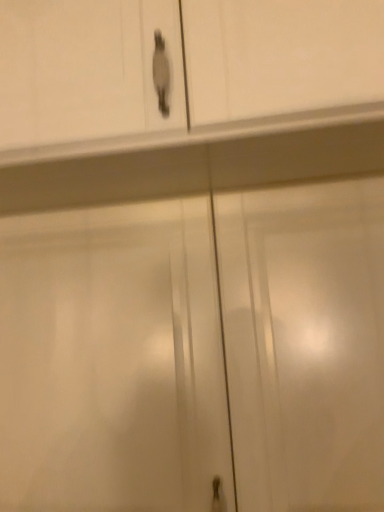
Question: Looking at the image, does white glossy cabinet doors at center seem bigger or smaller compared to matte white cabinet at upper center?

Choices:
 (A) big
 (B) small

Answer: (B)

Question: Would you say white glossy cabinet doors at center is inside or outside matte white cabinet at upper center?

Choices:
 (A) inside
 (B) outside

Answer: (B)

Question: From the image's perspective, is white glossy cabinet doors at center located above or below matte white cabinet at upper center?

Choices:
 (A) below
 (B) above

Answer: (A)

Question: Considering the positions of matte white cabinet at upper center and white glossy cabinet doors at center in the image, is matte white cabinet at upper center taller or shorter than white glossy cabinet doors at center?

Choices:
 (A) short
 (B) tall

Answer: (A)

Question: Is matte white cabinet at upper center inside the boundaries of white glossy cabinet doors at center, or outside?

Choices:
 (A) inside
 (B) outside

Answer: (B)

Question: Is point (41, 55) closer or farther from the camera than point (9, 394)?

Choices:
 (A) closer
 (B) farther

Answer: (A)

Question: Looking at the image, does matte white cabinet at upper center seem bigger or smaller compared to white glossy cabinet doors at center?

Choices:
 (A) small
 (B) big

Answer: (B)